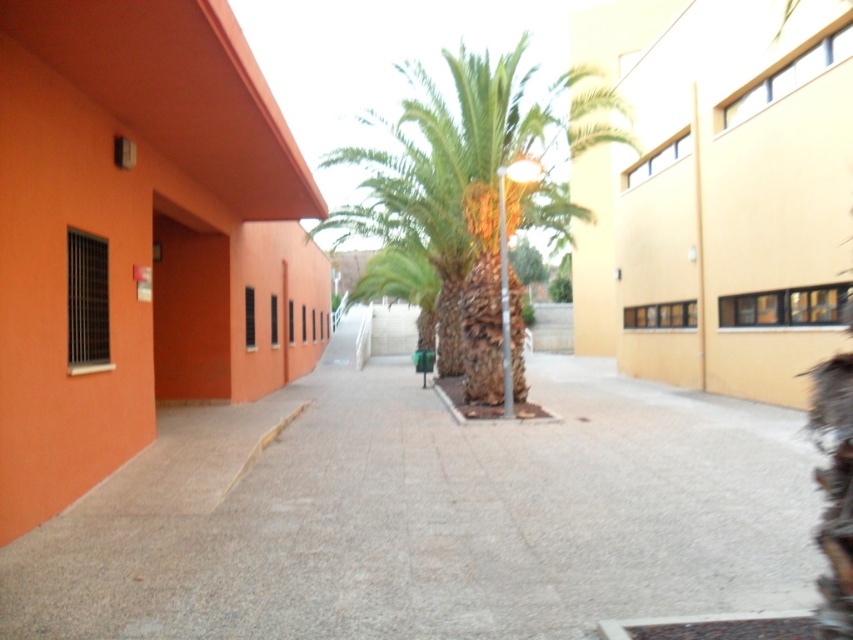
Is gray concrete pavement at center above green leafy palm at center?

No, gray concrete pavement at center is not above green leafy palm at center.

Can you confirm if gray concrete pavement at center is bigger than green leafy palm at center?

Actually, gray concrete pavement at center might be smaller than green leafy palm at center.

Is point (49, 580) behind point (463, 371)?

No, it is not.

Find the location of `gray concrete pavement at center`. gray concrete pavement at center is located at coordinates (428, 516).